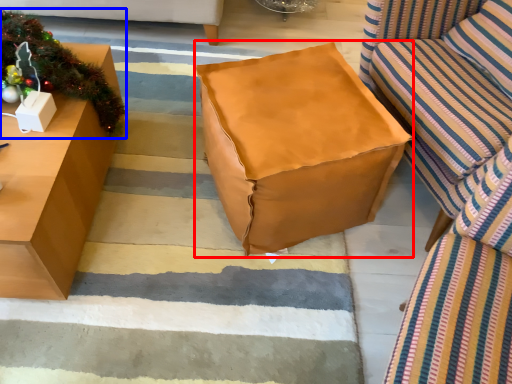
Question: Which object appears closest to the camera in this image, bean bag chair (highlighted by a red box) or christmas decoration (highlighted by a blue box)?

Choices:
 (A) bean bag chair
 (B) christmas decoration

Answer: (A)